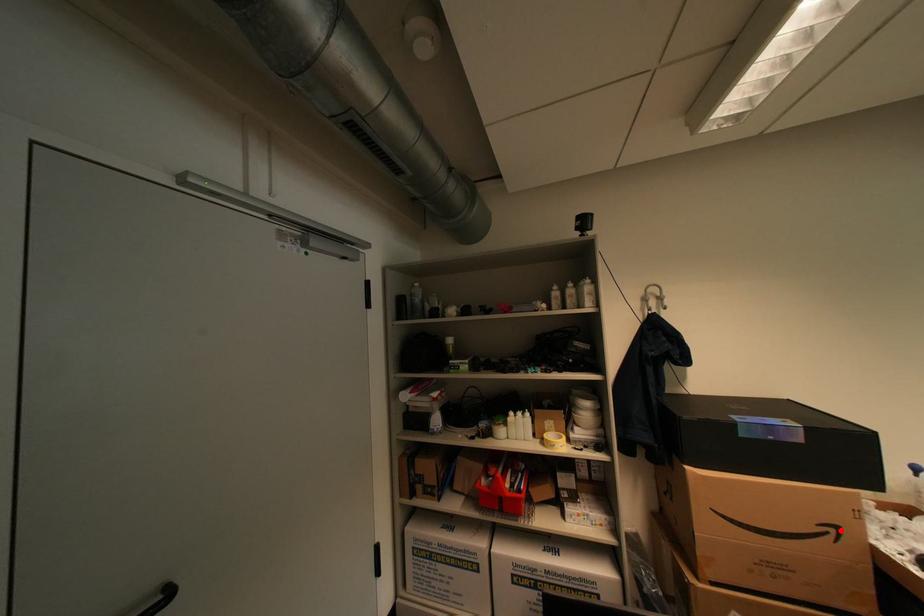
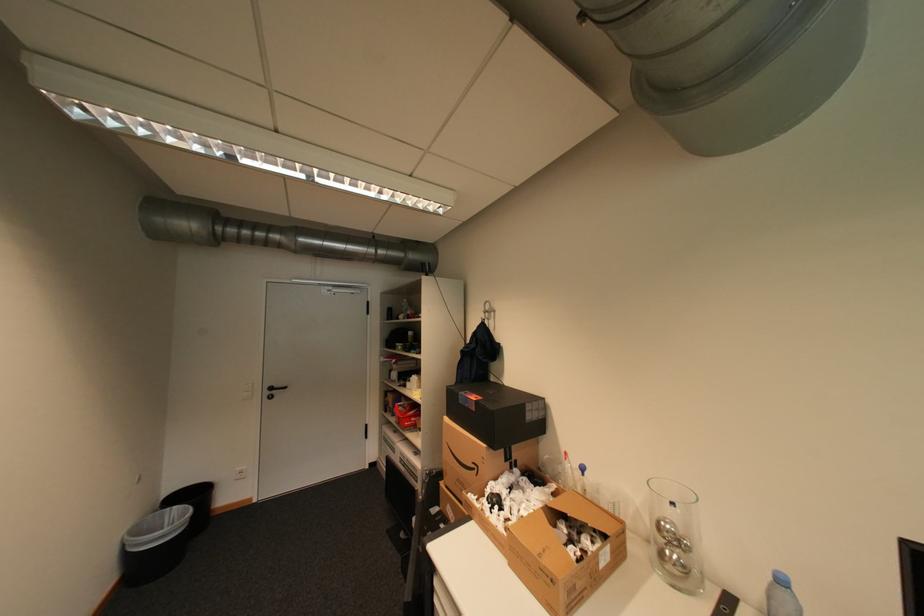
In the second image, find the point that corresponds to the highlighted location in the first image.

(484, 468)